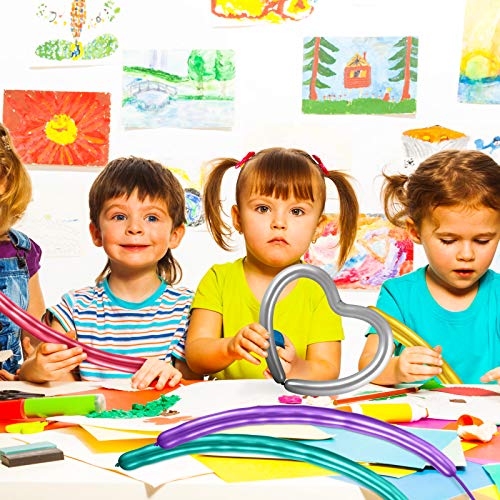
What are the coordinates of `red painting` in the screenshot? It's located at (101, 105).